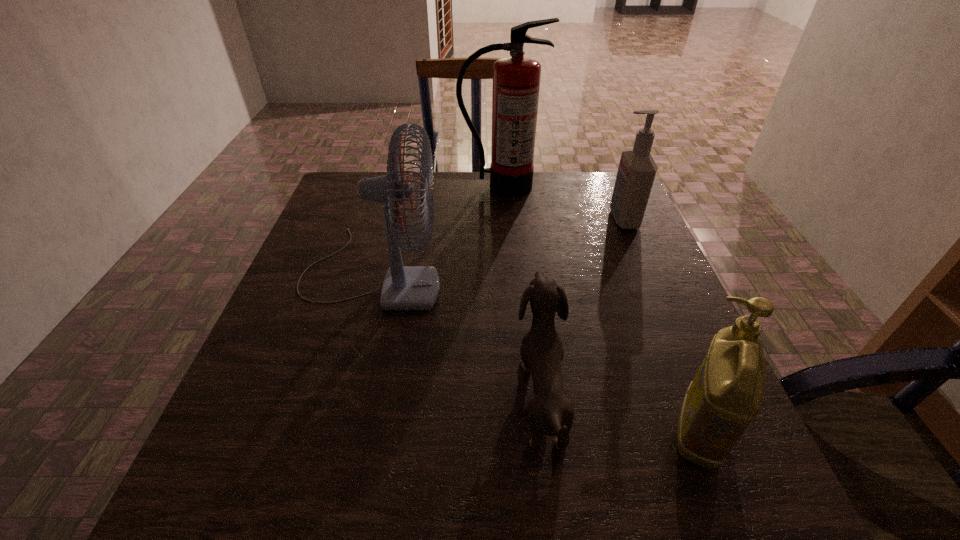
The image size is (960, 540). I want to click on vacant position located on the front label of the cleansing agent, so click(465, 219).

Locate an element on the screen. The width and height of the screenshot is (960, 540). free spot located on the front label of the cleansing agent is located at coordinates (465, 219).

Locate an element on the screen. This screenshot has height=540, width=960. vacant space situated on the left of the second shortest object is located at coordinates (522, 431).

This screenshot has height=540, width=960. In order to click on blank space located 0.270m at the face of the puppy in this screenshot , I will do point(370,393).

Where is `vacant region located 0.050m at the face of the puppy`? The width and height of the screenshot is (960, 540). vacant region located 0.050m at the face of the puppy is located at coordinates (491, 393).

At what (x,y) coordinates should I click in order to perform the action: click on vacant space situated at the face of the puppy. Please return your answer as a coordinate pair (x, y). The image size is (960, 540). Looking at the image, I should click on (326, 393).

The image size is (960, 540). What are the coordinates of `fire extinguisher at the far edge` in the screenshot? It's located at (516, 79).

Identify the location of cleansing agent at the far edge. 637,169.

Image resolution: width=960 pixels, height=540 pixels. I want to click on detergent that is positioned at the near edge, so click(726, 394).

Identify the location of puppy present at the near edge. Image resolution: width=960 pixels, height=540 pixels. point(551,413).